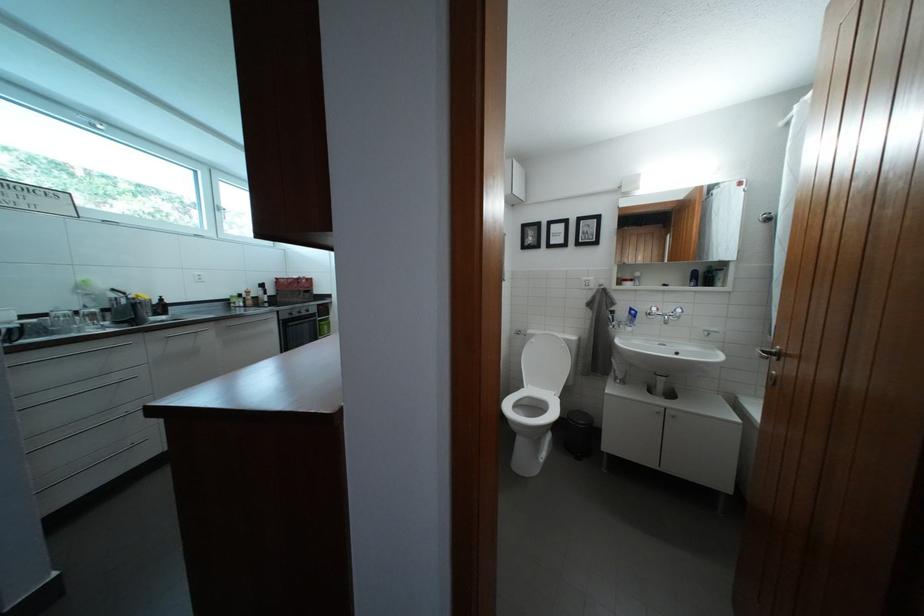
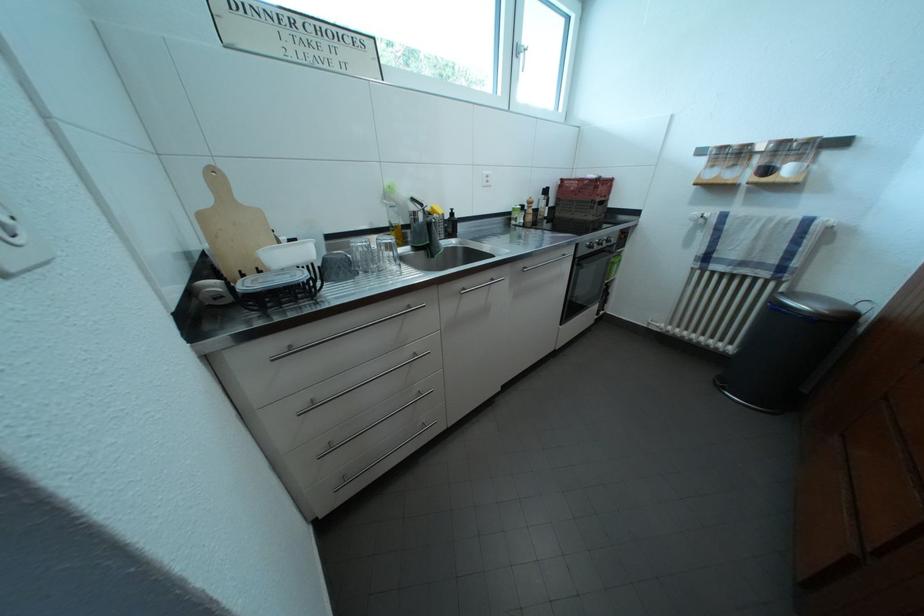
The point at (308, 289) is marked in the first image. Where is the corresponding point in the second image?

(605, 193)